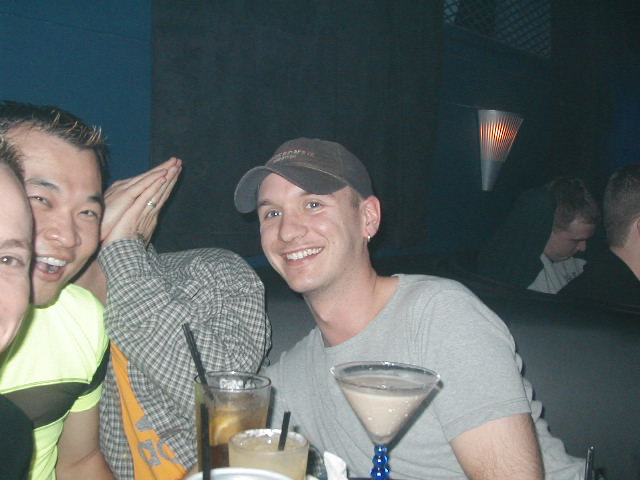
Where is `lighted sconce`? This screenshot has width=640, height=480. lighted sconce is located at coordinates (488, 172).